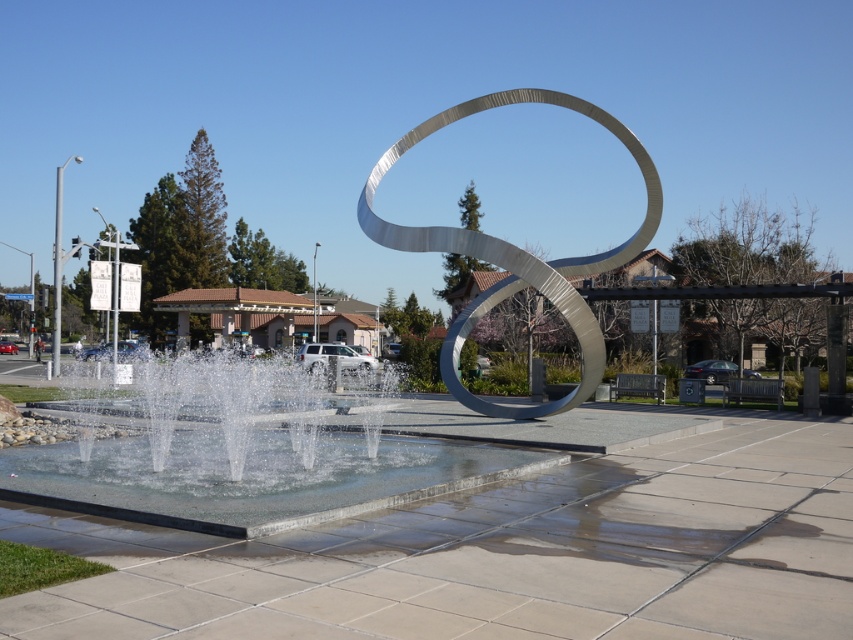
You are standing in the public space and want to locate the clear glass water at center. According to the coordinates provided, where should you look relative to the sculpture?

The clear glass water at center is located at coordinates point (248,452), which means it is positioned to the right and slightly above the sculpture.

You are standing in the public space and want to take a photo of the silver metallic sculpture at center without the clear water at center appearing in the background. Is it possible to position yourself in such a way that the sculpture is visible but the water is not?

The clear water at center is closer to the viewer than the silver metallic sculpture at center. Therefore, to avoid the water in the background, you would need to position yourself behind the water feature so that the sculpture is in front and the water is out of frame.